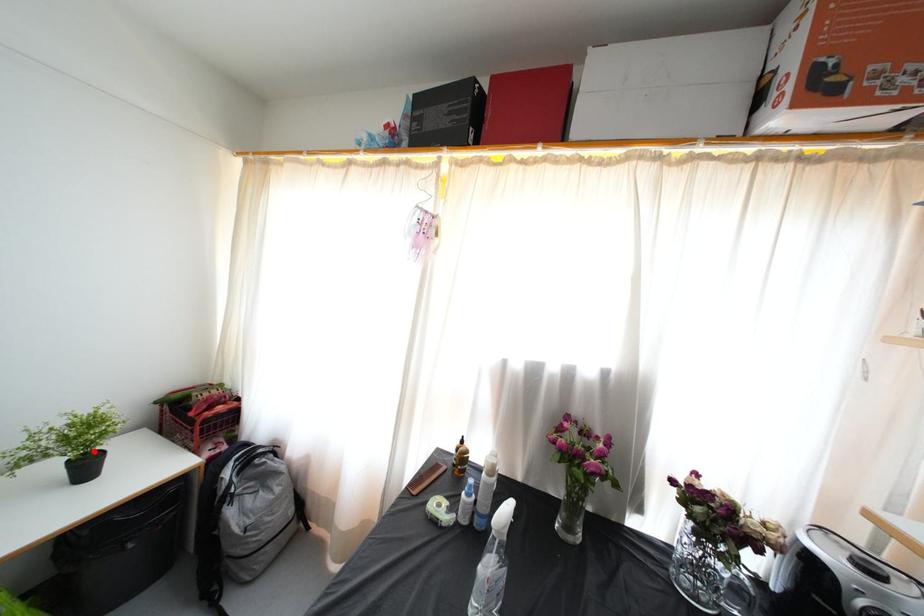
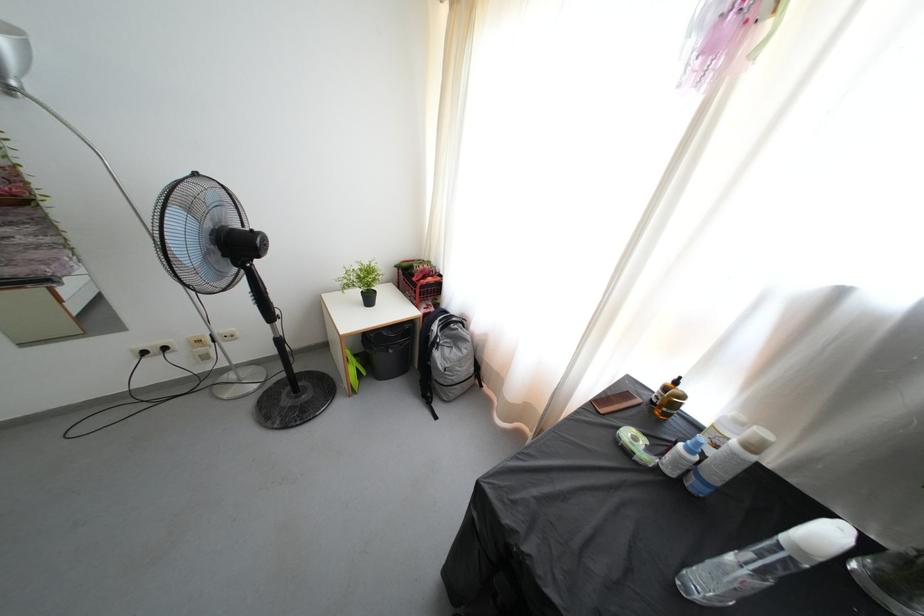
In the second image, find the point that corresponds to the highlighted location in the first image.

(373, 291)